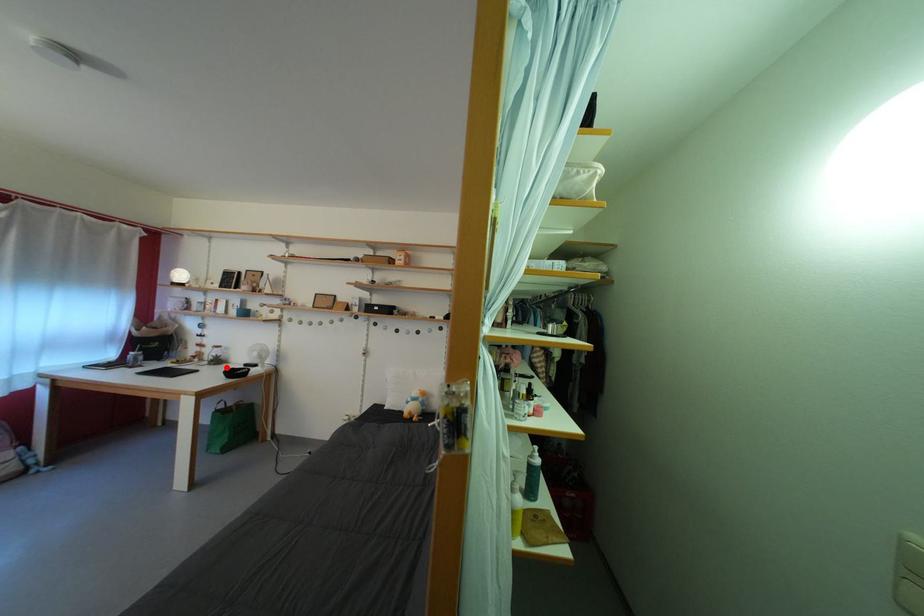
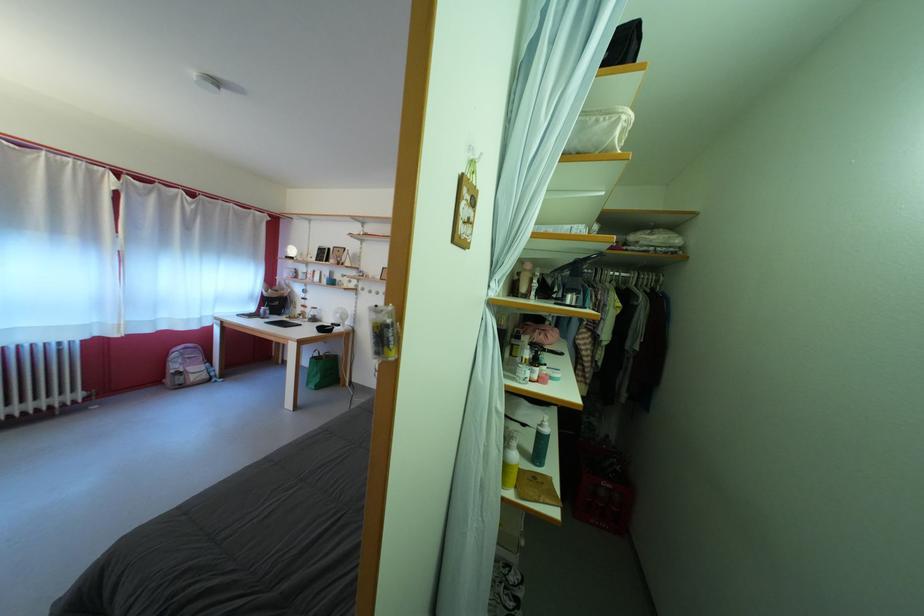
The point at the highlighted location is marked in the first image. Where is the corresponding point in the second image?

(322, 325)